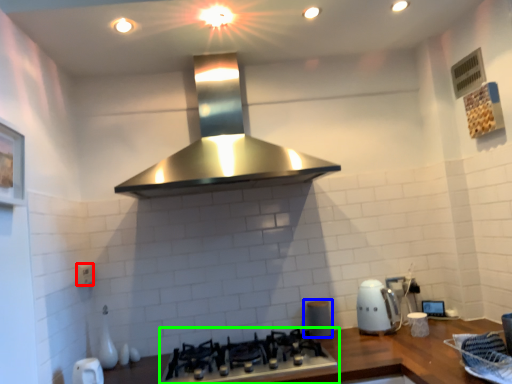
Question: Which object is positioned closest to electric outlet (highlighted by a red box)? Select from appliance (highlighted by a blue box) and gas stove (highlighted by a green box).

Choices:
 (A) appliance
 (B) gas stove

Answer: (B)